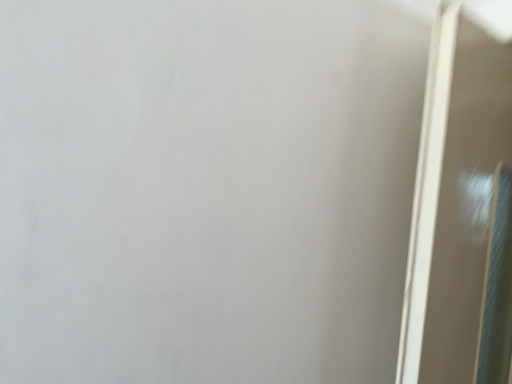
This screenshot has width=512, height=384. What do you see at coordinates (461, 213) in the screenshot?
I see `transparent glass door at right` at bounding box center [461, 213].

Locate an element on the screen. Image resolution: width=512 pixels, height=384 pixels. transparent glass door at right is located at coordinates (461, 213).

Identify the location of transparent glass door at right. (461, 213).